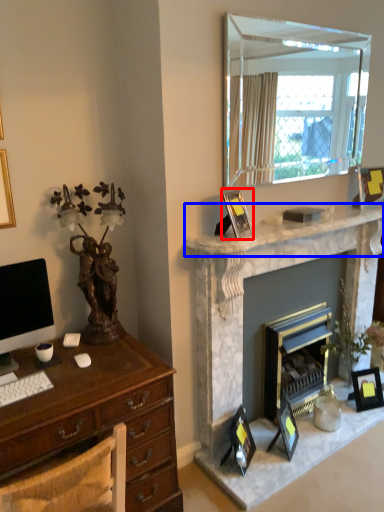
Question: Which object is further to the camera taking this photo, picture frame (highlighted by a red box) or mantle (highlighted by a blue box)?

Choices:
 (A) picture frame
 (B) mantle

Answer: (A)